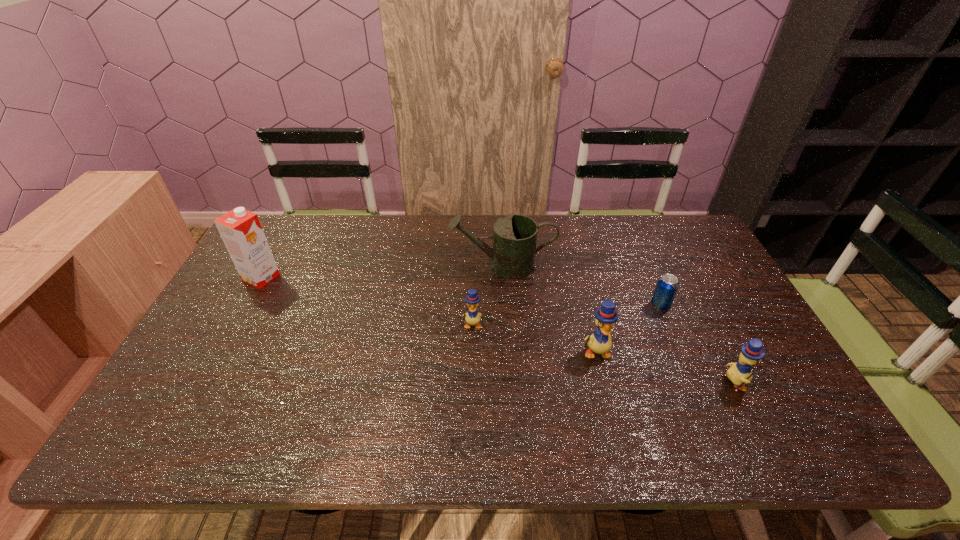
At what (x,y) coordinates should I click in order to perform the action: click on object that is at the near edge. Please return your answer as a coordinate pair (x, y). Image resolution: width=960 pixels, height=540 pixels. Looking at the image, I should click on (752, 352).

Locate an element on the screen. object located in the left edge section of the desktop is located at coordinates (241, 231).

Identify the location of object that is at the right edge. (752, 352).

The width and height of the screenshot is (960, 540). I want to click on object present at the near right corner, so click(x=752, y=352).

In the image, there is a desktop. At what (x,y) coordinates should I click in order to perform the action: click on vacant space at the far edge. Please return your answer as a coordinate pair (x, y). The image size is (960, 540). Looking at the image, I should click on (401, 237).

In the image, there is a desktop. At what (x,y) coordinates should I click in order to perform the action: click on vacant space at the near edge. Please return your answer as a coordinate pair (x, y). The width and height of the screenshot is (960, 540). Looking at the image, I should click on (572, 385).

Image resolution: width=960 pixels, height=540 pixels. In the image, there is a desktop. Identify the location of vacant region at the left edge. (222, 299).

Image resolution: width=960 pixels, height=540 pixels. In the image, there is a desktop. Identify the location of free space at the right edge. (779, 362).

You are a GUI agent. You are given a task and a screenshot of the screen. Output one action in this format:
    pyautogui.click(x=<x>, y=<y>)
    Task: Click on the free space at the near left corner
    The image size is (960, 540).
    Given the screenshot: What is the action you would take?
    pyautogui.click(x=206, y=405)

Identify the location of unoccupied area between the third object from right to left and the leftmost duckling. The image size is (960, 540). (534, 338).